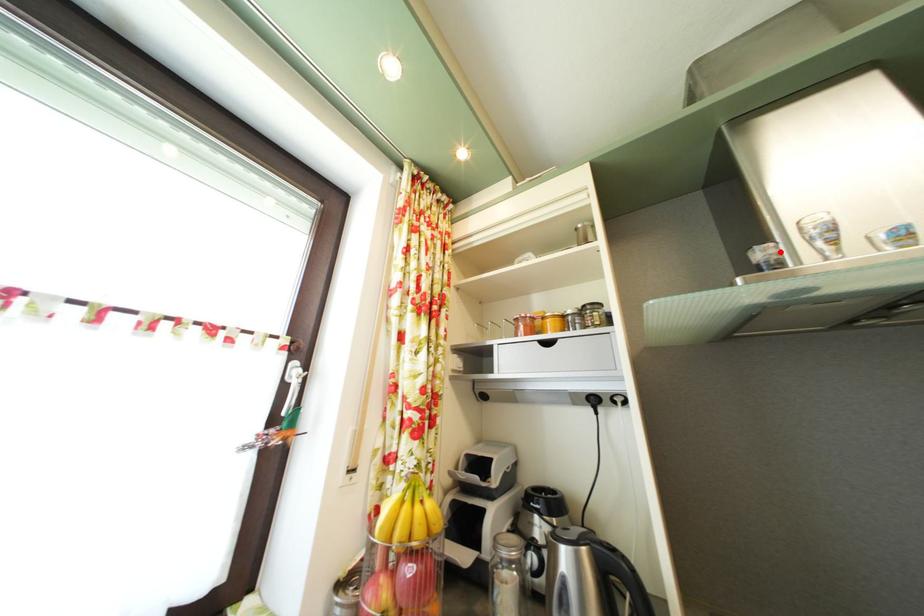
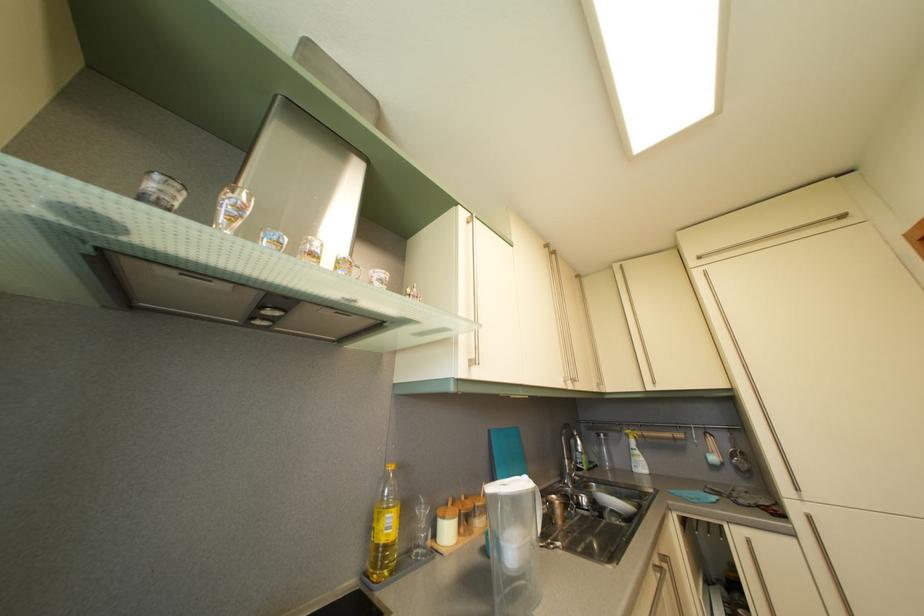
Locate, in the second image, the point that corresponds to the highlighted location in the first image.

(186, 193)